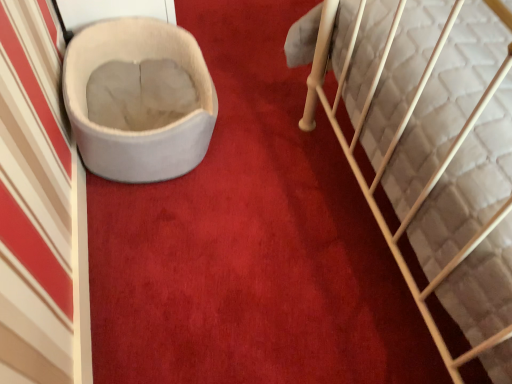
Question: Does white plush cat bed at left have a lesser width compared to soft gray fabric cat bed at left?

Choices:
 (A) no
 (B) yes

Answer: (B)

Question: From the image's perspective, is white plush cat bed at left beneath soft gray fabric cat bed at left?

Choices:
 (A) yes
 (B) no

Answer: (B)

Question: Is white plush cat bed at left oriented away from soft gray fabric cat bed at left?

Choices:
 (A) yes
 (B) no

Answer: (B)

Question: Considering the relative sizes of white plush cat bed at left and soft gray fabric cat bed at left in the image provided, is white plush cat bed at left shorter than soft gray fabric cat bed at left?

Choices:
 (A) yes
 (B) no

Answer: (B)

Question: Is soft gray fabric cat bed at left a part of white plush cat bed at left?

Choices:
 (A) no
 (B) yes

Answer: (A)

Question: Does white plush cat bed at left appear on the right side of soft gray fabric cat bed at left?

Choices:
 (A) no
 (B) yes

Answer: (A)

Question: Is soft gray fabric cat bed at left touching white plush cat bed at left?

Choices:
 (A) no
 (B) yes

Answer: (A)

Question: From the image's perspective, is soft gray fabric cat bed at left located above white plush cat bed at left?

Choices:
 (A) no
 (B) yes

Answer: (A)

Question: Is soft gray fabric cat bed at left positioned before white plush cat bed at left?

Choices:
 (A) no
 (B) yes

Answer: (B)

Question: Considering the relative sizes of soft gray fabric cat bed at left and white plush cat bed at left in the image provided, is soft gray fabric cat bed at left thinner than white plush cat bed at left?

Choices:
 (A) no
 (B) yes

Answer: (A)

Question: Would you say soft gray fabric cat bed at left is outside white plush cat bed at left?

Choices:
 (A) yes
 (B) no

Answer: (A)

Question: Would you consider soft gray fabric cat bed at left to be distant from white plush cat bed at left?

Choices:
 (A) yes
 (B) no

Answer: (B)

Question: From the image's perspective, relative to soft gray fabric cat bed at left, is white plush cat bed at left above or below?

Choices:
 (A) above
 (B) below

Answer: (A)